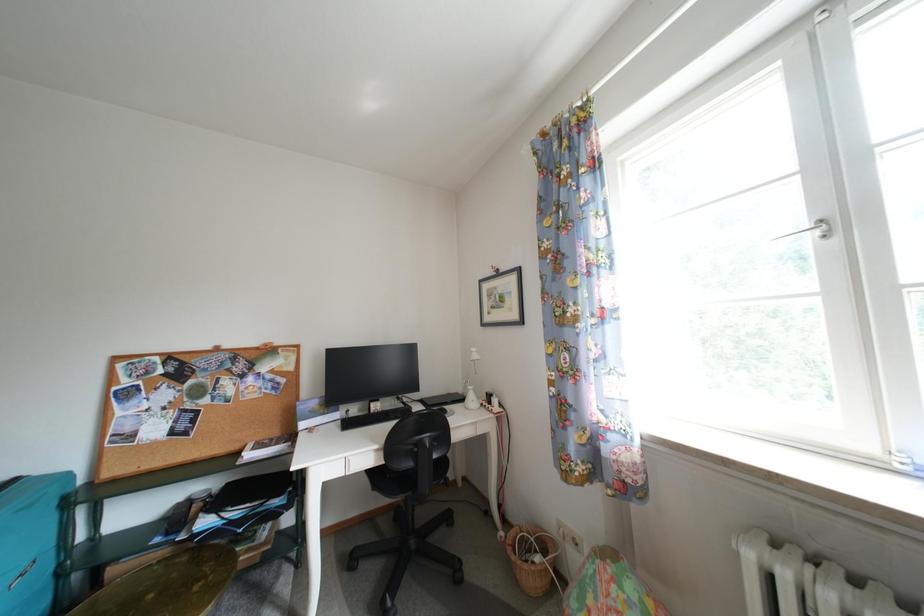
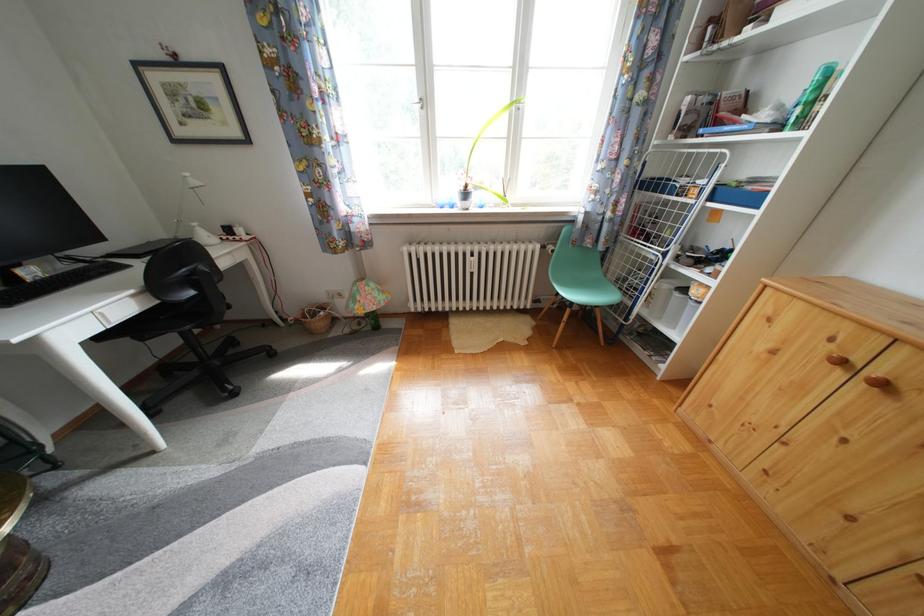
The images are taken continuously from a first-person perspective. In which direction is your viewpoint rotating?

The camera rotated toward right-down.